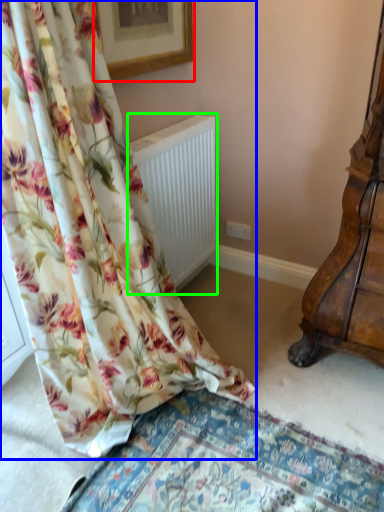
Question: Which object is the closest to the picture frame (highlighted by a red box)? Choose among these: curtain (highlighted by a blue box) or radiator (highlighted by a green box).

Choices:
 (A) curtain
 (B) radiator

Answer: (B)